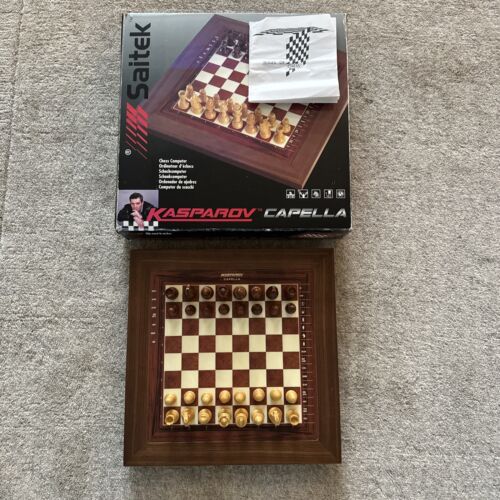
Identify the location of grey carpet. The height and width of the screenshot is (500, 500). (378, 448).